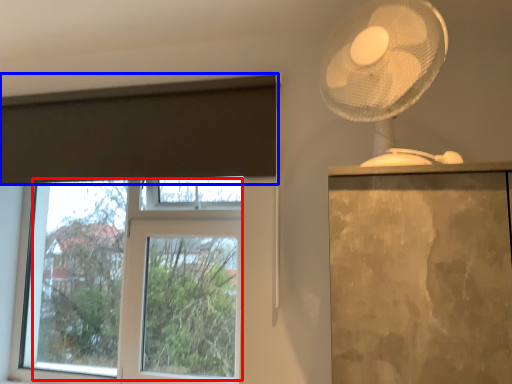
Question: Which of the following is the farthest to the observer, bay window (highlighted by a red box) or curtain (highlighted by a blue box)?

Choices:
 (A) bay window
 (B) curtain

Answer: (A)